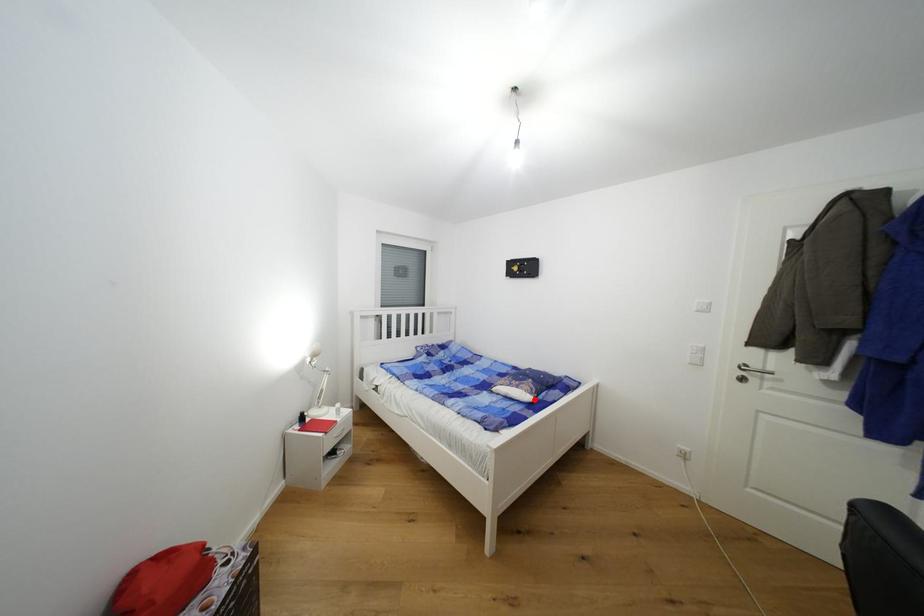
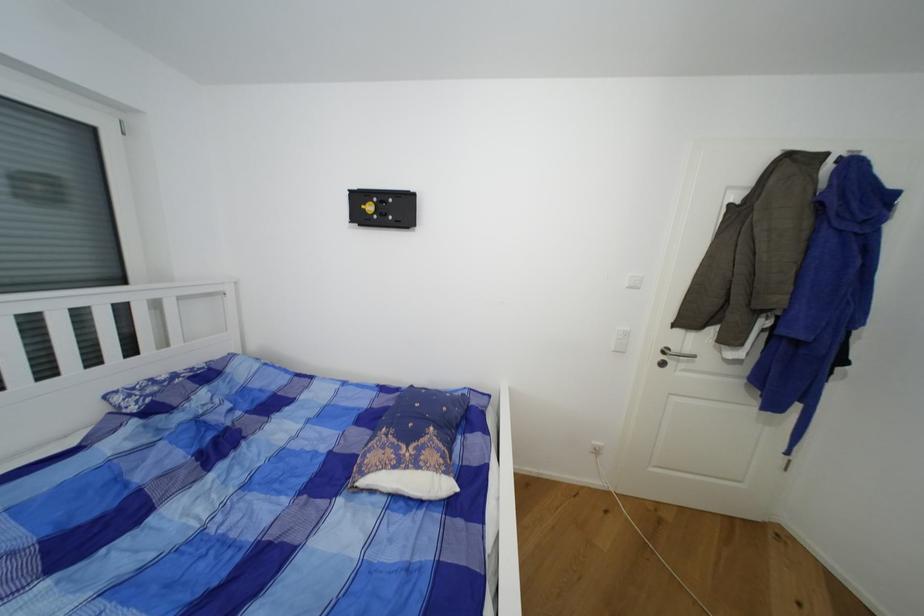
The point at the highlighted location is marked in the first image. Where is the corresponding point in the second image?

(454, 488)